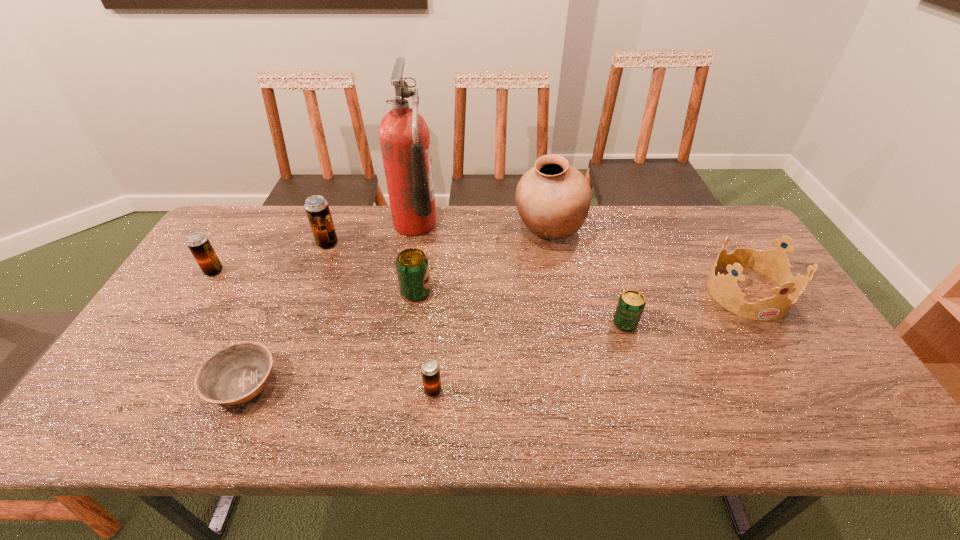
At what (x,y) coordinates should I click in order to perform the action: click on free space between the fire extinguisher and the second object from right to left. Please return your answer as a coordinate pair (x, y). The image size is (960, 540). Looking at the image, I should click on (520, 274).

Image resolution: width=960 pixels, height=540 pixels. I want to click on unoccupied area between the red fire extinguisher and the nearest black beer can, so click(x=424, y=307).

Where is `vacant point located between the third beer can from left to right and the third object from right to left`? This screenshot has height=540, width=960. vacant point located between the third beer can from left to right and the third object from right to left is located at coordinates (482, 261).

Identify the location of free point between the bigger green beer can and the second nearest black beer can. (315, 281).

Locate an element on the screen. Image resolution: width=960 pixels, height=540 pixels. free point between the eighth shortest object and the red fire extinguisher is located at coordinates (482, 227).

At what (x,y) coordinates should I click in order to perform the action: click on free point between the shortest object and the tiara. Please return your answer as a coordinate pair (x, y). This screenshot has width=960, height=540. Looking at the image, I should click on (495, 338).

Locate an element on the screen. The image size is (960, 540). empty space between the nearer green beer can and the bowl is located at coordinates (434, 354).

Identify the location of object that is the eighth closest one to the second tallest object. (198, 243).

Locate an element on the screen. The image size is (960, 540). the fifth closest object to the third nearest beer can is located at coordinates click(x=235, y=374).

The width and height of the screenshot is (960, 540). I want to click on the second closest beer can to the shortest object, so click(x=412, y=267).